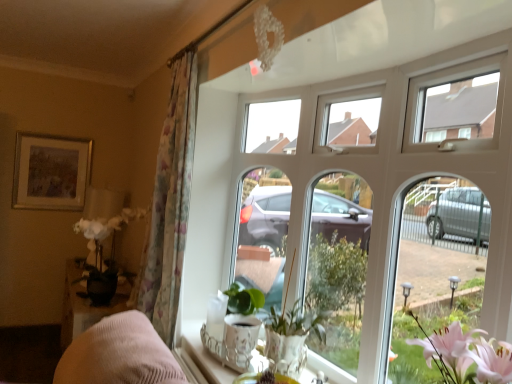
This screenshot has height=384, width=512. What are the coordinates of `free space above white glass window at center (from a real-world perspective)` in the screenshot? It's located at (376, 54).